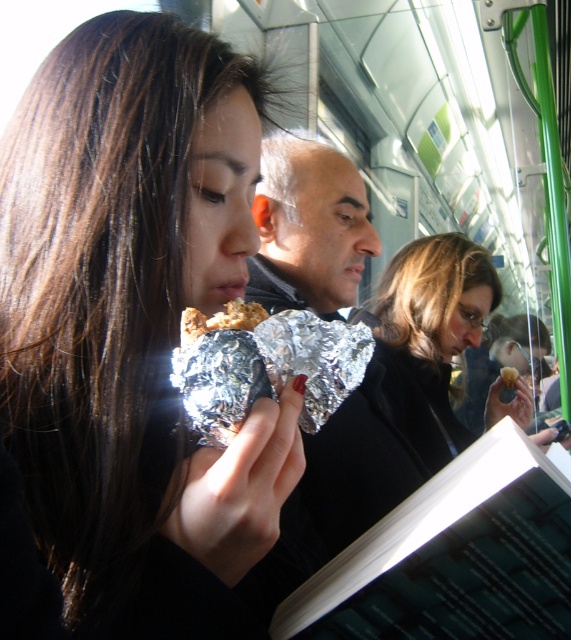
Between shiny metallic sandwich at center and shiny silver foil at center, which one appears on the left side from the viewer's perspective?

shiny metallic sandwich at center is more to the left.

Is shiny metallic sandwich at center further to the viewer compared to shiny silver foil at center?

No, shiny metallic sandwich at center is in front of shiny silver foil at center.

Is point (323, 380) closer to viewer compared to point (516, 381)?

Yes, point (323, 380) is in front of point (516, 381).

In order to click on shiny metallic sandwich at center in this screenshot , I will do `click(263, 364)`.

Which of these two, shiny metallic food at center or shiny metallic sandwich at center, stands taller?

shiny metallic food at center is taller.

Who is positioned more to the left, shiny metallic food at center or shiny metallic sandwich at center?

Positioned to the left is shiny metallic food at center.

Measure the distance between point (208, 536) and camera.

15.40 inches

Where is `shiny metallic food at center`? Image resolution: width=571 pixels, height=640 pixels. shiny metallic food at center is located at coordinates (122, 307).

Is shiny metallic food at center above matte black jacket at center?

Correct, shiny metallic food at center is located above matte black jacket at center.

Who is positioned more to the right, shiny metallic food at center or matte black jacket at center?

matte black jacket at center

At what (x,y) coordinates should I click in order to perform the action: click on shiny metallic food at center. Please return your answer as a coordinate pair (x, y). Looking at the image, I should click on (122, 307).

I want to click on shiny metallic food at center, so click(x=122, y=307).